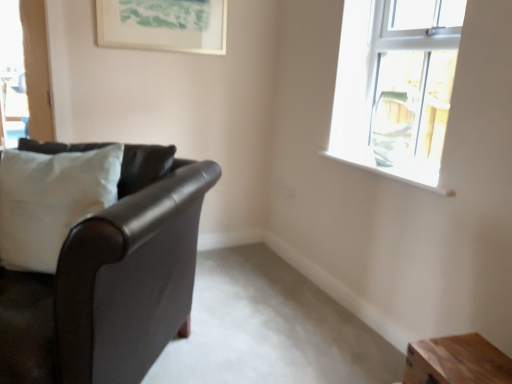
The width and height of the screenshot is (512, 384). Find the location of `blank space situated above wooden table at lower right (from a real-world perspective)`. blank space situated above wooden table at lower right (from a real-world perspective) is located at coordinates (476, 365).